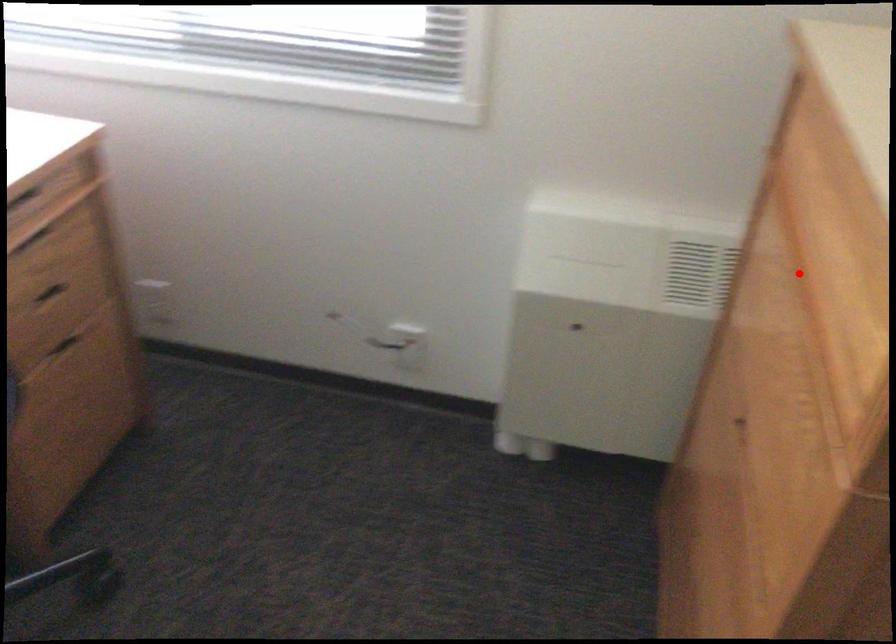
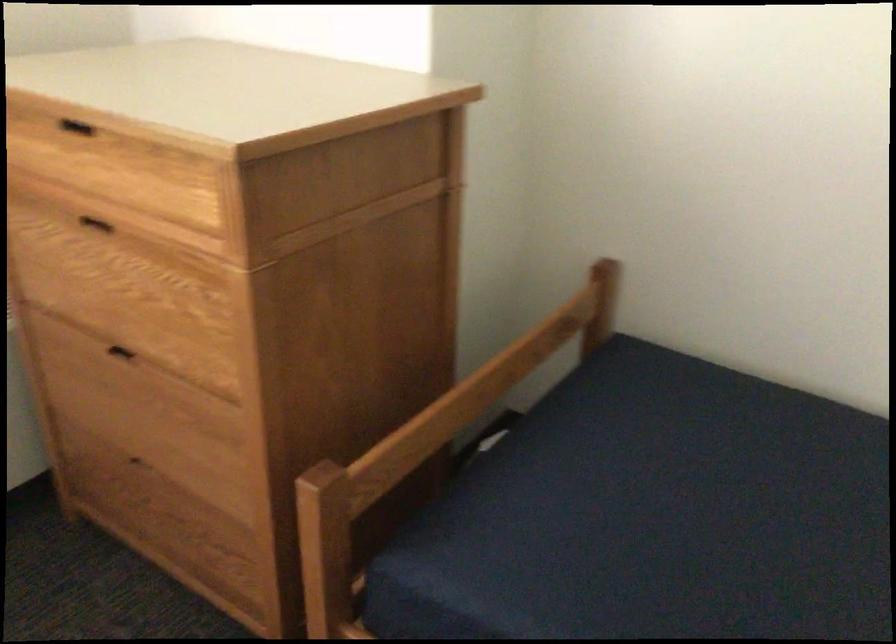
Locate, in the second image, the point that corresponds to the highlighted location in the first image.

(96, 223)